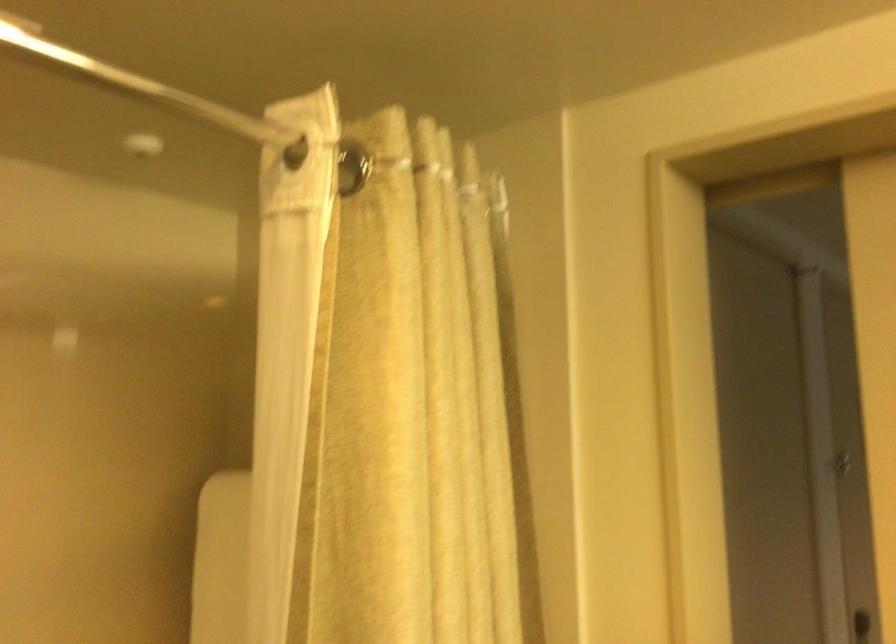
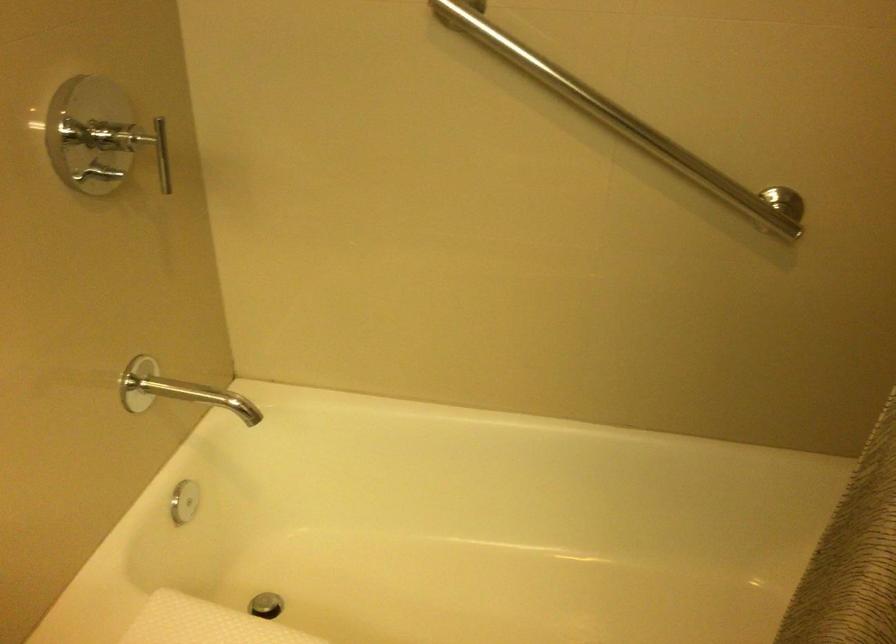
First-person continuous shooting, in which direction is the camera rotating?

The camera rotated toward left-down.